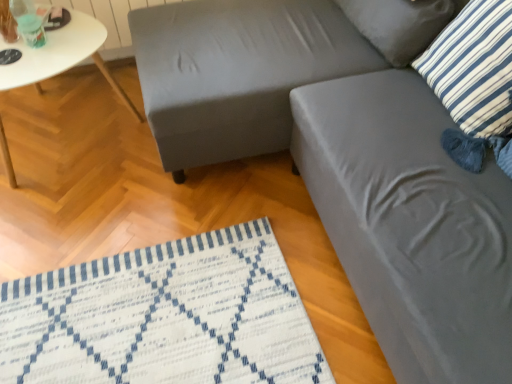
Question: Visually, is white glossy table at left positioned to the left or to the right of blue striped pillow at upper right, the 1th pillow viewed from the back?

Choices:
 (A) left
 (B) right

Answer: (A)

Question: Is point (27, 56) closer or farther from the camera than point (404, 41)?

Choices:
 (A) closer
 (B) farther

Answer: (B)

Question: Which of these objects is positioned farthest from the blue striped pillow at upper right, which is counted as the second pillow, starting from the front?

Choices:
 (A) blue and white striped pillow at upper right, positioned as the second pillow in back-to-front order
 (B) white glossy table at left
 (C) matte gray swivel chair at center, arranged as the 1th swivel chair when ordered from the bottom
 (D) matte gray swivel chair at upper right, the first swivel chair positioned from the top

Answer: (B)

Question: Which is farther from the matte gray swivel chair at center, arranged as the 1th swivel chair when ordered from the bottom?

Choices:
 (A) blue and white striped pillow at upper right, positioned as the second pillow in back-to-front order
 (B) matte gray swivel chair at upper right, the first swivel chair positioned from the top
 (C) blue striped pillow at upper right, the 1th pillow viewed from the back
 (D) white glossy table at left

Answer: (D)